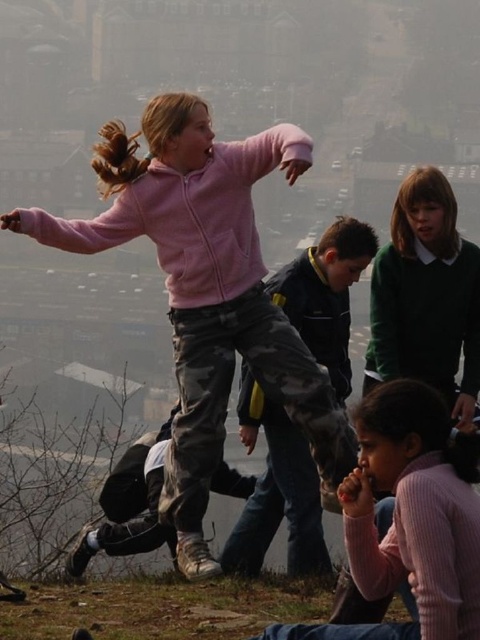
Between matte pink hoodie at upper left and pink ribbed sweater at lower right, which one appears on the right side from the viewer's perspective?

pink ribbed sweater at lower right

Who is lower down, matte pink hoodie at upper left or pink ribbed sweater at lower right?

pink ribbed sweater at lower right is lower down.

Is point (303, 348) behind point (396, 458)?

Yes.

In order to click on matte pink hoodie at upper left in this screenshot , I will do `click(205, 291)`.